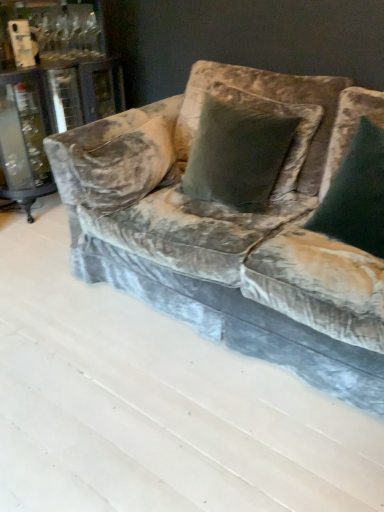
Question: Is dark green velvet pillow at center, which is counted as the first pillow, starting from the right, not within velvet green pillow at center, which is the first pillow in left-to-right order?

Choices:
 (A) no
 (B) yes

Answer: (B)

Question: Does dark green velvet pillow at center, which is counted as the first pillow, starting from the right, have a lesser height compared to velvet green pillow at center, the second pillow positioned from the right?

Choices:
 (A) no
 (B) yes

Answer: (A)

Question: From the image's perspective, is dark green velvet pillow at center, which is counted as the first pillow, starting from the right, located beneath velvet green pillow at center, the second pillow positioned from the right?

Choices:
 (A) no
 (B) yes

Answer: (B)

Question: Is dark green velvet pillow at center, which is counted as the first pillow, starting from the right, aimed at velvet green pillow at center, which is the first pillow in left-to-right order?

Choices:
 (A) yes
 (B) no

Answer: (B)

Question: From the image's perspective, is dark green velvet pillow at center, which is counted as the first pillow, starting from the right, on top of velvet green pillow at center, the second pillow positioned from the right?

Choices:
 (A) yes
 (B) no

Answer: (B)

Question: Is the position of dark green velvet pillow at center, which is counted as the first pillow, starting from the right, more distant than that of velvet green pillow at center, which is the first pillow in left-to-right order?

Choices:
 (A) no
 (B) yes

Answer: (A)

Question: Does velvet green pillow at center, which is the first pillow in left-to-right order, have a greater width compared to dark green velvet pillow at center, which appears as the second pillow when viewed from the left?

Choices:
 (A) no
 (B) yes

Answer: (B)

Question: Can you confirm if velvet green pillow at center, the second pillow positioned from the right, is shorter than dark green velvet pillow at center, which appears as the second pillow when viewed from the left?

Choices:
 (A) no
 (B) yes

Answer: (B)

Question: Can we say velvet green pillow at center, which is the first pillow in left-to-right order, lies outside dark green velvet pillow at center, which appears as the second pillow when viewed from the left?

Choices:
 (A) yes
 (B) no

Answer: (A)

Question: From the image's perspective, is velvet green pillow at center, the second pillow positioned from the right, under dark green velvet pillow at center, which is counted as the first pillow, starting from the right?

Choices:
 (A) yes
 (B) no

Answer: (B)

Question: From a real-world perspective, is velvet green pillow at center, the second pillow positioned from the right, located higher than dark green velvet pillow at center, which is counted as the first pillow, starting from the right?

Choices:
 (A) no
 (B) yes

Answer: (B)

Question: Does velvet green pillow at center, which is the first pillow in left-to-right order, have a larger size compared to dark green velvet pillow at center, which is counted as the first pillow, starting from the right?

Choices:
 (A) no
 (B) yes

Answer: (B)

Question: From a real-world perspective, is dark green velvet pillow at center, which appears as the second pillow when viewed from the left, on top of velvet couch at center?

Choices:
 (A) no
 (B) yes

Answer: (B)